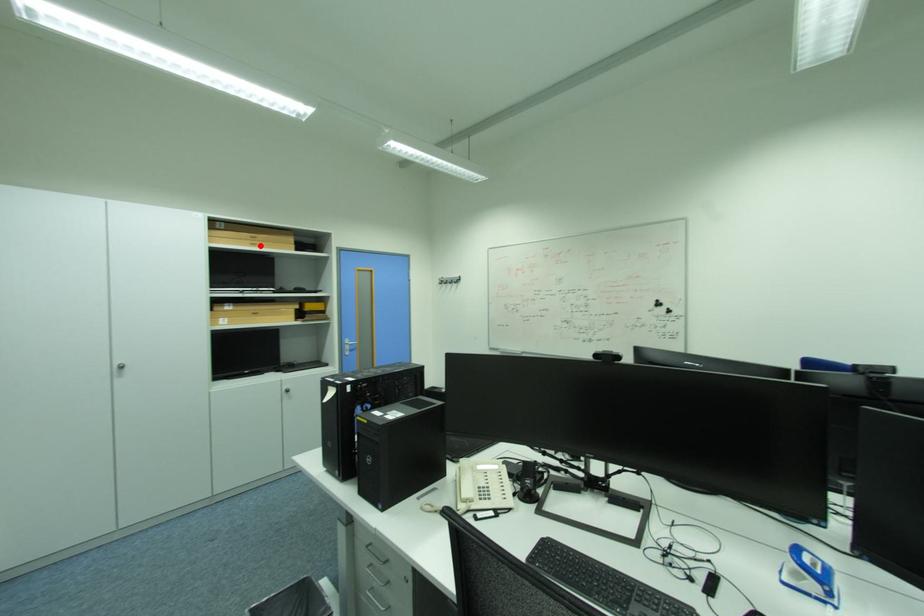
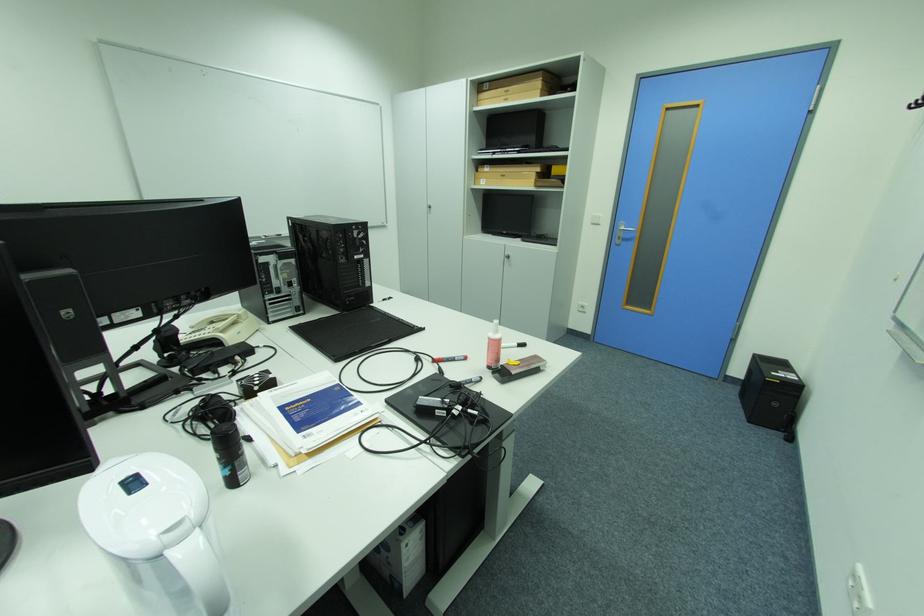
Question: A red point is marked in image1. In image2, is the corresponding 3D point closer to the camera or farther? Reply with the corresponding letter.

Choices:
 (A) The corresponding 3D point is closer.
 (B) The corresponding 3D point is farther.

Answer: (A)